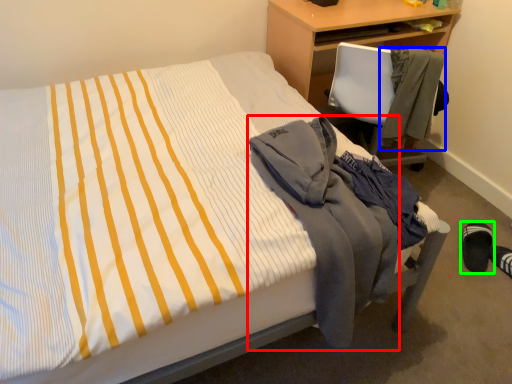
Question: Estimate the real-world distances between objects in this image. Which object is closer to jacket (highlighted by a red box), jacket (highlighted by a blue box) or footwear (highlighted by a green box)?

Choices:
 (A) jacket
 (B) footwear

Answer: (A)